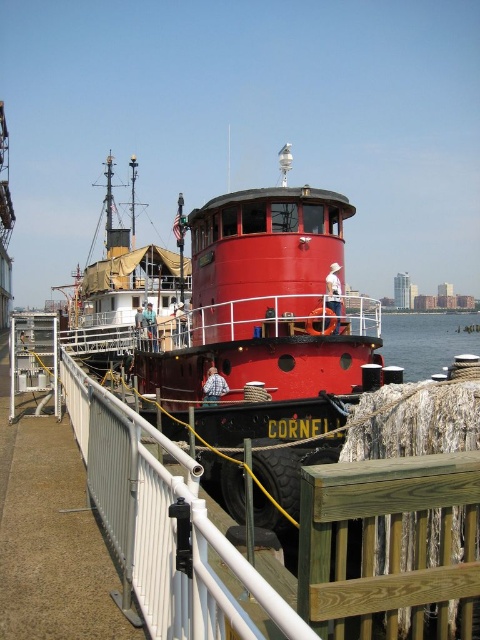
Question: Which point is closer to the camera taking this photo?

Choices:
 (A) (98, 301)
 (B) (186, 372)

Answer: (B)

Question: Is shiny red boat at center to the right of brushed metal boat at center from the viewer's perspective?

Choices:
 (A) no
 (B) yes

Answer: (B)

Question: Which point is farther to the camera?

Choices:
 (A) (160, 339)
 (B) (104, 284)

Answer: (B)

Question: Is shiny red boat at center wider than brushed metal boat at center?

Choices:
 (A) yes
 (B) no

Answer: (B)

Question: Can you confirm if shiny red boat at center is positioned to the right of brushed metal boat at center?

Choices:
 (A) yes
 (B) no

Answer: (A)